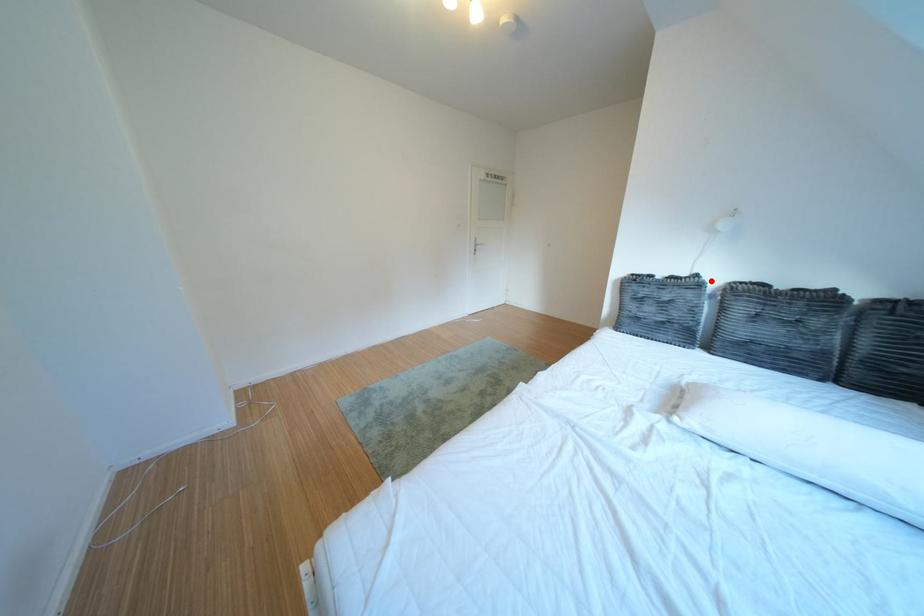
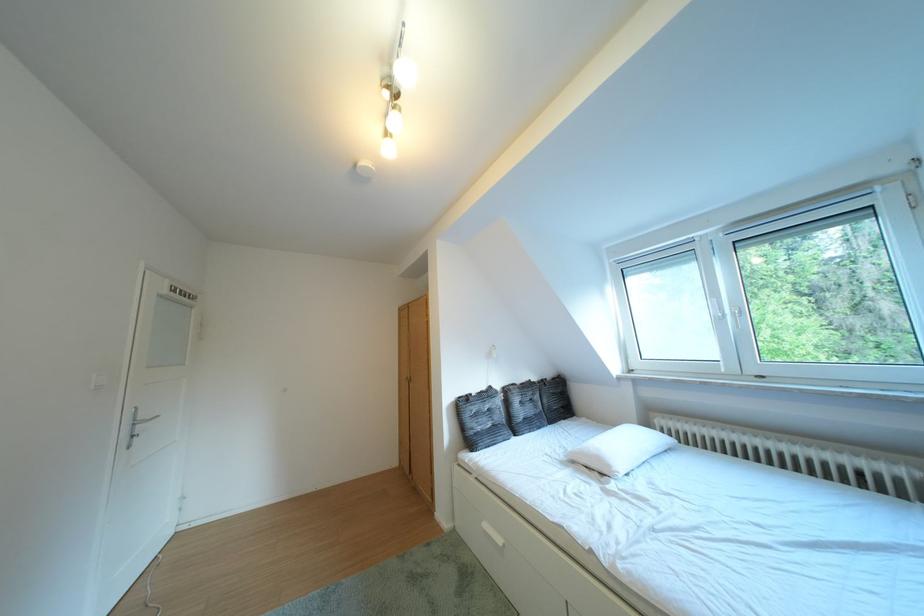
Question: A red point is marked in image1. In image2, is the corresponding 3D point closer to the camera or farther? Reply with the corresponding letter.

Choices:
 (A) The corresponding 3D point is closer.
 (B) The corresponding 3D point is farther.

Answer: (B)